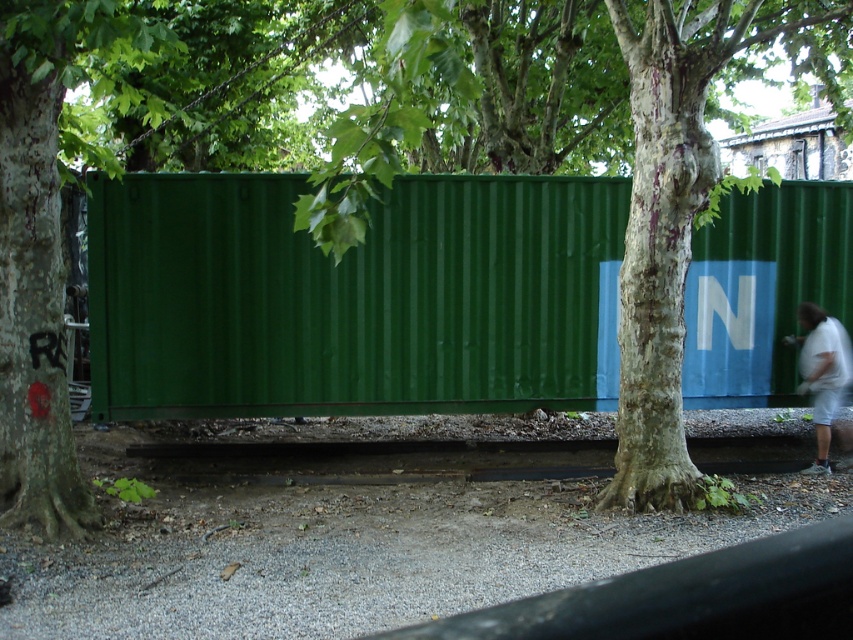
Does point (289, 362) come behind point (825, 422)?

No, (289, 362) is in front of (825, 422).

Is point (167, 372) closer to camera compared to point (850, 355)?

Yes, point (167, 372) is closer to viewer.

Does point (345, 403) come behind point (824, 417)?

Yes, it is.

The image size is (853, 640). Find the location of `green corrugated metal shipping container at center`. green corrugated metal shipping container at center is located at coordinates (352, 298).